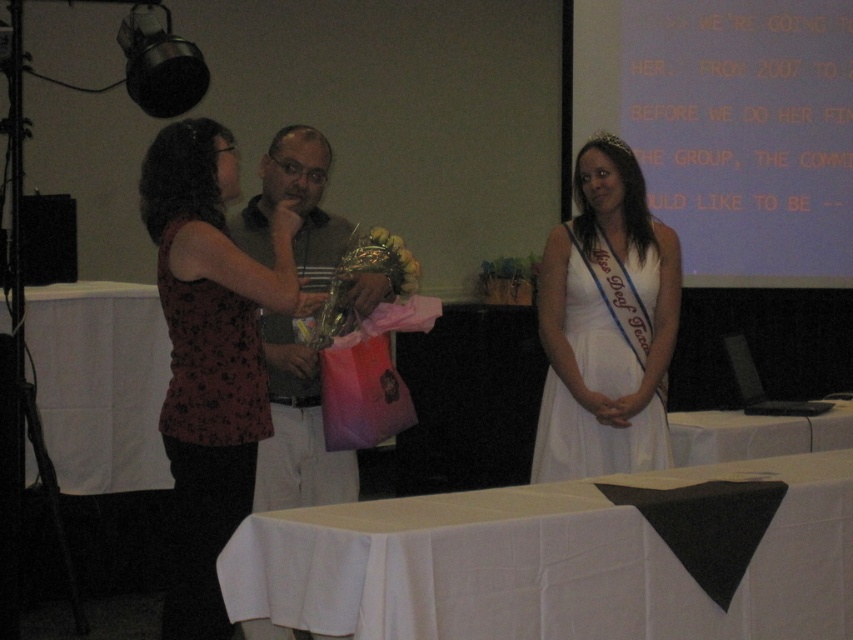
In the scene described, there are two items at the center of the image. What is the spatial relationship between the white satin dress at center and the matte plastic bag at center?

The white satin dress at center is positioned to the right of the matte plastic bag at center.

You are standing at the origin of the coordinate system. You see two points, point (576, 241) and point (618, 145). Which point is closer to you?

Point (618, 145) is closer to you because it is in front of point (576, 241).